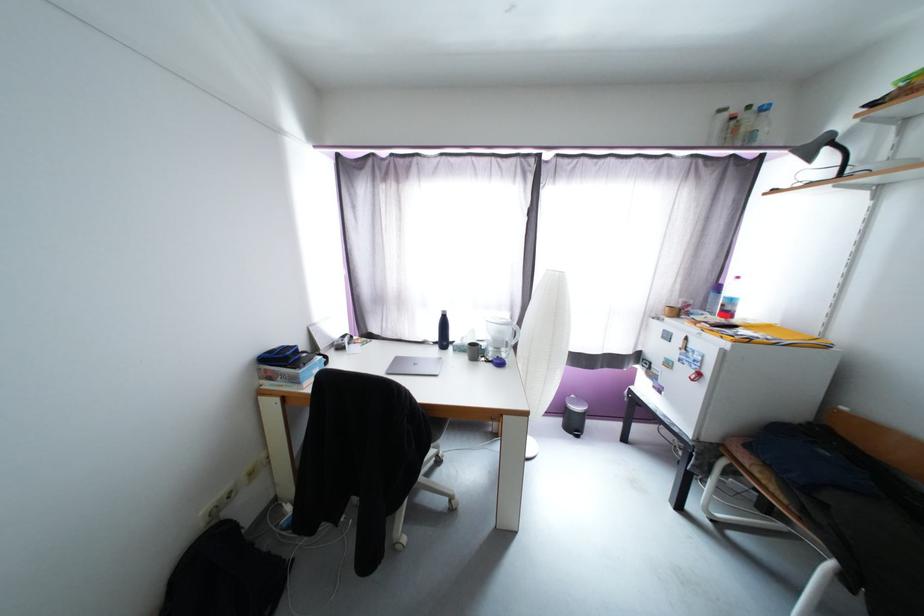
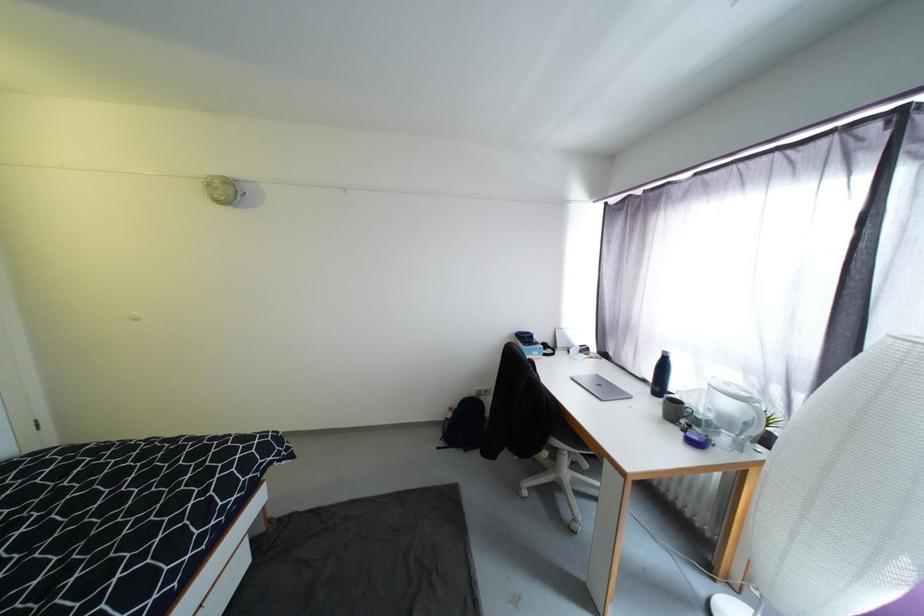
Find the pixel in the second image that matches pixel 480 354 in the first image.

(683, 413)